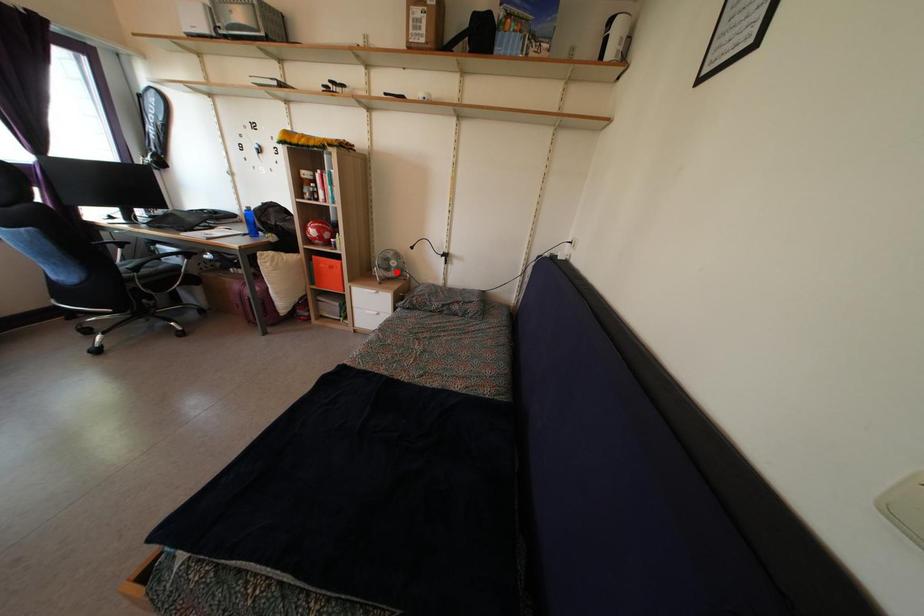
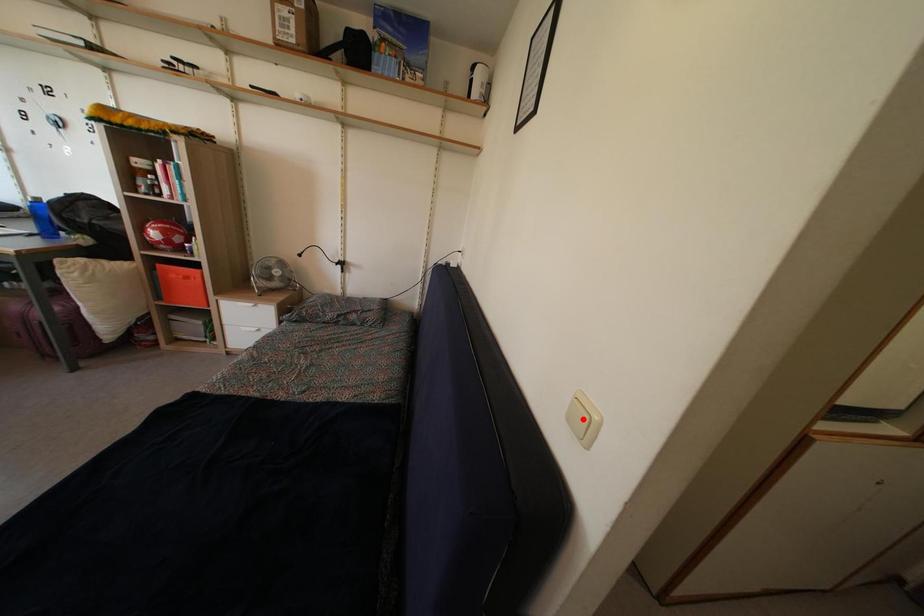
I am providing you with two images of the same scene from different viewpoints. A red point is marked on the first image and another point is marked on the second image. Do the highlighted points in image1 and image2 indicate the same real-world spot?

No